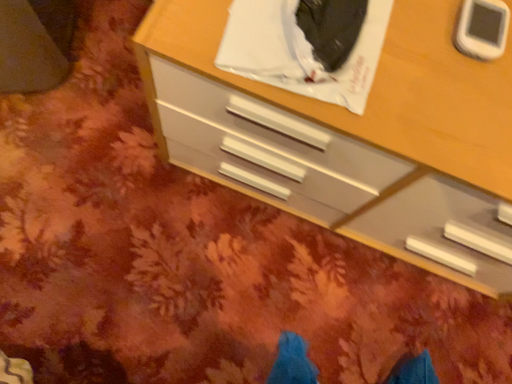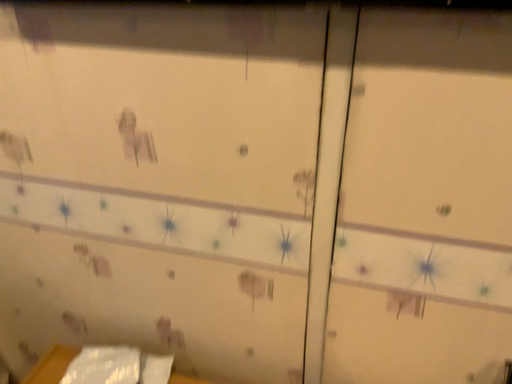
Question: Which way did the camera rotate in the video?

Choices:
 (A) rotated downward
 (B) rotated upward

Answer: (B)